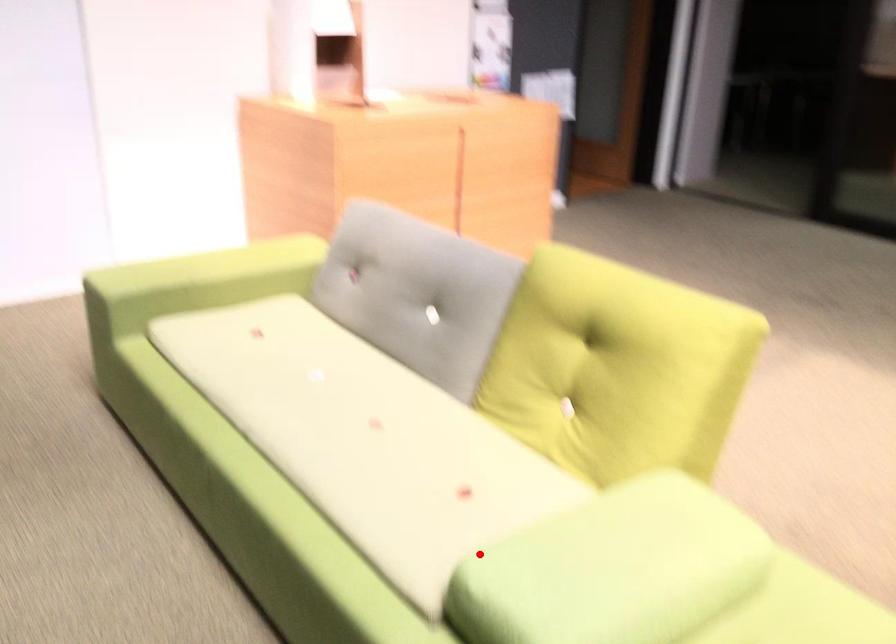
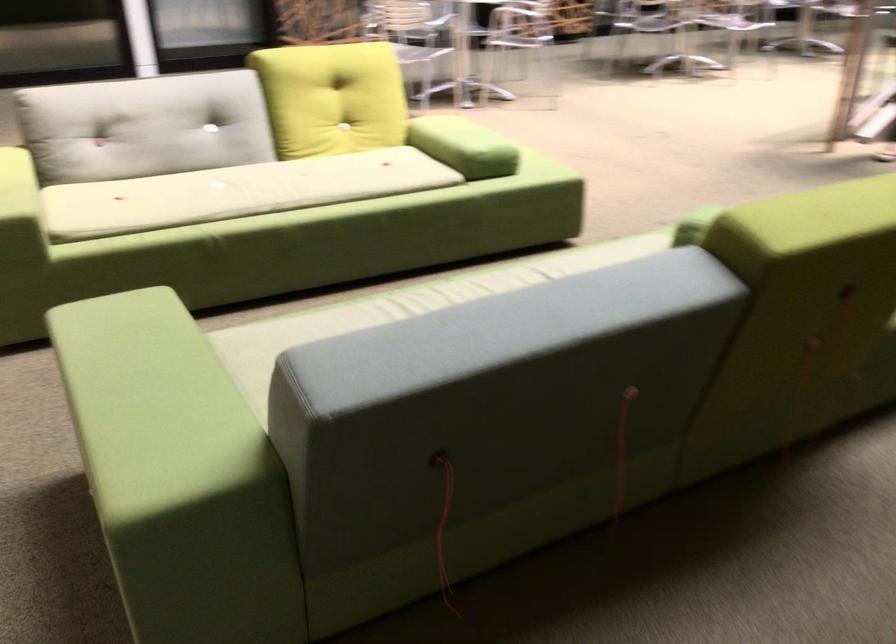
Question: I am providing you with two images of the same scene from different viewpoints. In image1, a red point is highlighted. Considering the same 3D point in image2, which of the following is correct?

Choices:
 (A) It is closer
 (B) It is farther

Answer: (B)